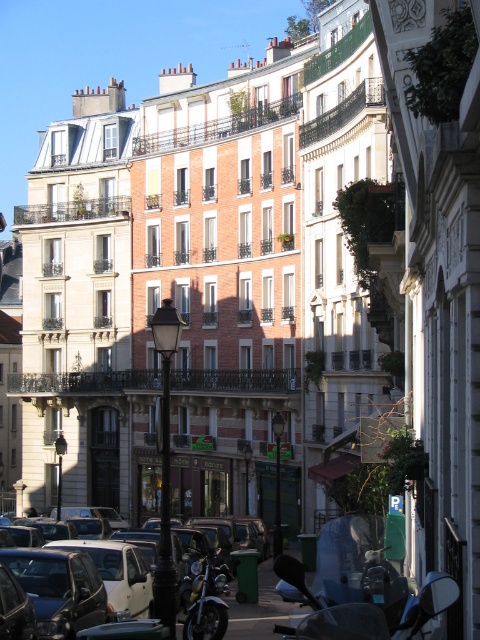
Which is above, shiny chrome motorcycle at lower right or white matte car at center?

Positioned higher is shiny chrome motorcycle at lower right.

Is point (444, 604) positioned before point (268, 596)?

Yes, it is.

Locate an element on the screen. shiny chrome motorcycle at lower right is located at coordinates (361, 609).

Is point (190, 628) behind point (264, 602)?

No, it is not.

Does point (188, 612) come in front of point (266, 628)?

Yes, point (188, 612) is closer to viewer.

This screenshot has height=640, width=480. Identify the location of shiny chrome motorcycle at center. (205, 600).

Does shiny chrome motorcycle at lower right appear over shiny chrome motorcycle at center?

Correct, shiny chrome motorcycle at lower right is located above shiny chrome motorcycle at center.

Does shiny chrome motorcycle at lower right have a smaller size compared to shiny chrome motorcycle at center?

No, shiny chrome motorcycle at lower right is not smaller than shiny chrome motorcycle at center.

Between point (361, 605) and point (189, 627), which one is positioned behind?

Point (189, 627)

This screenshot has width=480, height=640. Find the location of `shiny chrome motorcycle at lower right`. shiny chrome motorcycle at lower right is located at coordinates (361, 609).